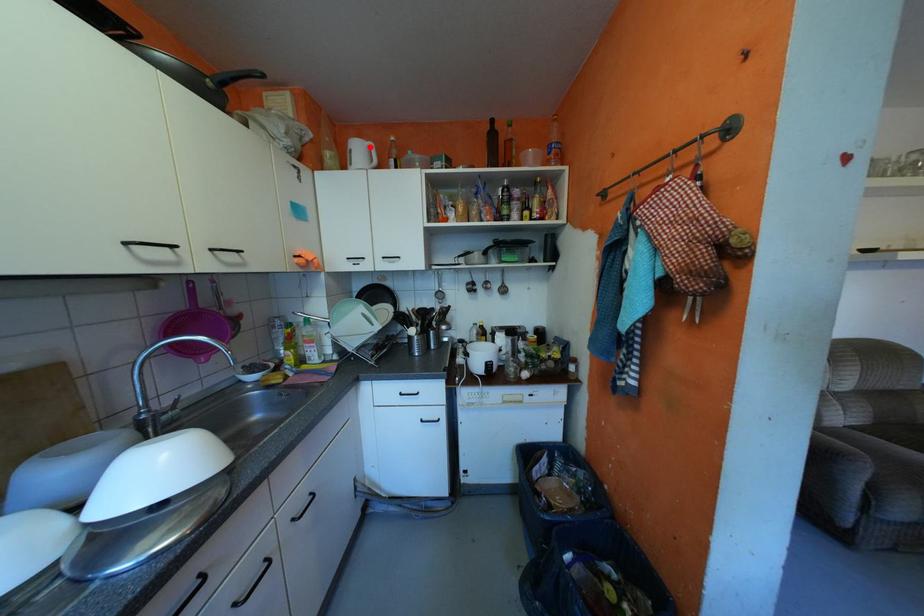
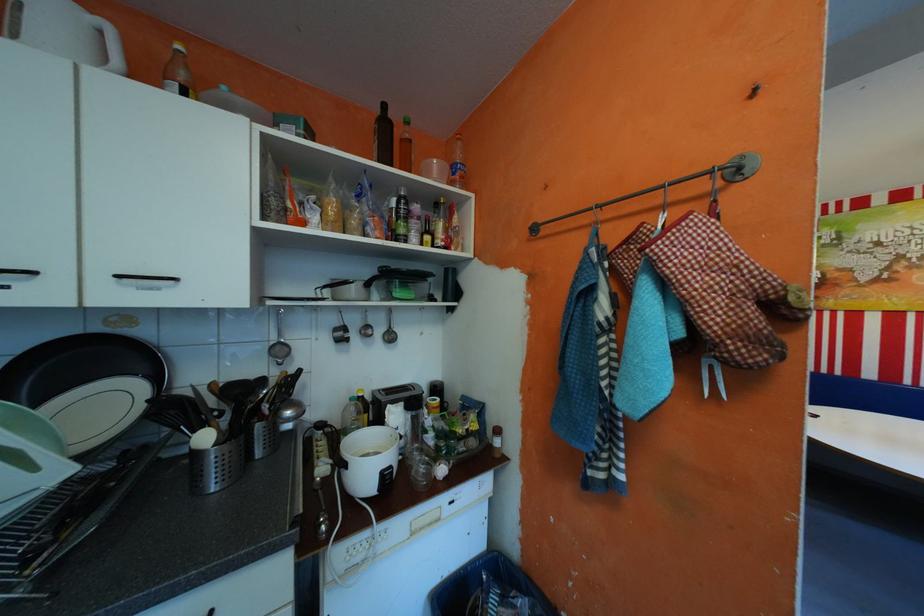
Find the pixel in the second image that matches the highlighted location in the first image.

(66, 12)